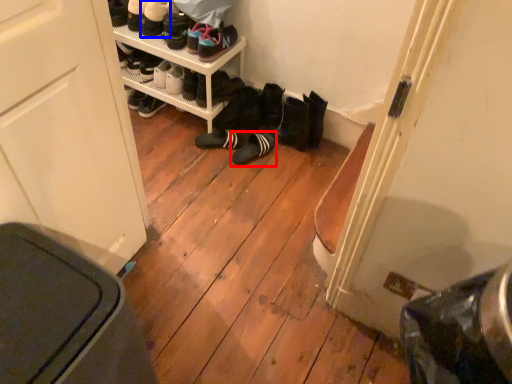
Question: Which object is further to the camera taking this photo, footwear (highlighted by a red box) or footwear (highlighted by a blue box)?

Choices:
 (A) footwear
 (B) footwear

Answer: (A)